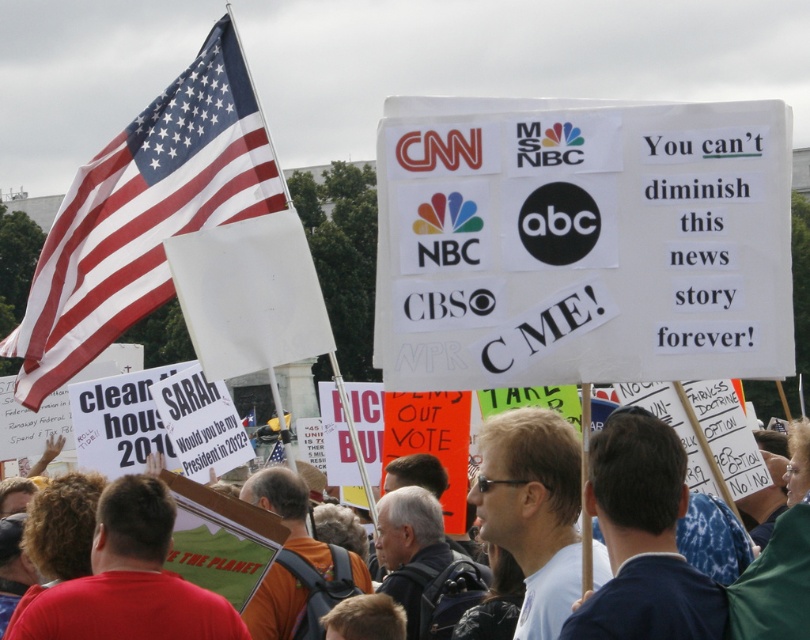
Question: Can you confirm if white cardboard sign at center is positioned below blue fabric shirt at center?

Choices:
 (A) no
 (B) yes

Answer: (B)

Question: Which of the following is the farthest from the observer?

Choices:
 (A) (713, 636)
 (B) (222, 186)
 (C) (527, 321)

Answer: (B)

Question: Among these objects, which one is farthest from the camera?

Choices:
 (A) red-white striped fabric flag at left
 (B) white cardboard sign at center
 (C) white paper sign at center
 (D) blue fabric shirt at center

Answer: (A)

Question: Can you confirm if white cardboard sign at center is positioned to the left of blue fabric shirt at center?

Choices:
 (A) no
 (B) yes

Answer: (A)

Question: Which of the following is the closest to the observer?

Choices:
 (A) red-white striped fabric flag at left
 (B) white paper sign at center
 (C) blue fabric shirt at center

Answer: (B)

Question: Is white paper sign at center smaller than red-white striped fabric flag at left?

Choices:
 (A) yes
 (B) no

Answer: (A)